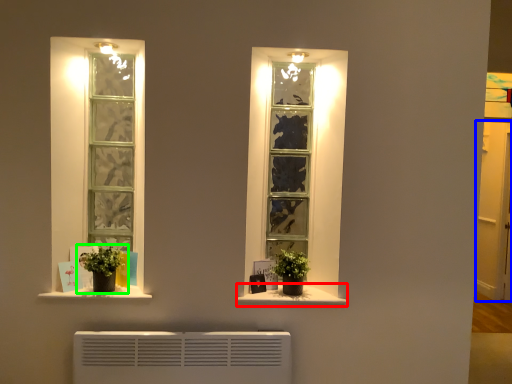
Question: Which object is positioned farthest from window sill (highlighted by a red box)? Select from glass door (highlighted by a blue box) and houseplant (highlighted by a green box).

Choices:
 (A) glass door
 (B) houseplant

Answer: (A)